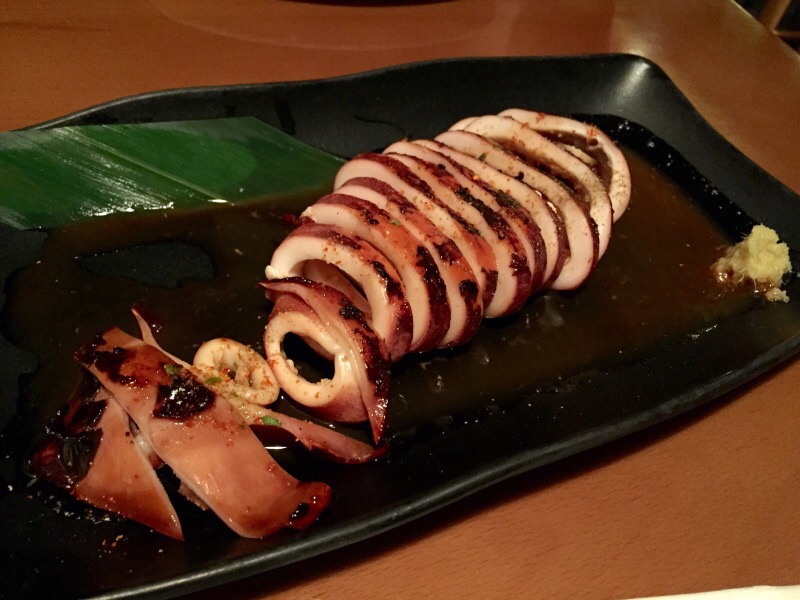
The image size is (800, 600). In order to click on inner wall of plate in this screenshot , I will do `click(389, 95)`, `click(726, 166)`.